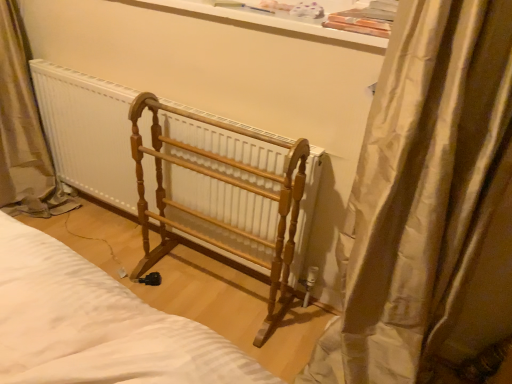
Question: From the image's perspective, relative to white glossy window sill at upper center, is wooden radiator at center above or below?

Choices:
 (A) above
 (B) below

Answer: (B)

Question: Considering their positions, is wooden radiator at center located in front of or behind white glossy window sill at upper center?

Choices:
 (A) front
 (B) behind

Answer: (B)

Question: Estimate the real-world distances between objects in this image. Which object is closer to the wooden radiator at center?

Choices:
 (A) silky beige curtain at right
 (B) light brown wood rack at center
 (C) white glossy window sill at upper center

Answer: (B)

Question: Considering the real-world distances, which object is farthest from the wooden radiator at center?

Choices:
 (A) light brown wood rack at center
 (B) white glossy window sill at upper center
 (C) silky beige curtain at right

Answer: (C)